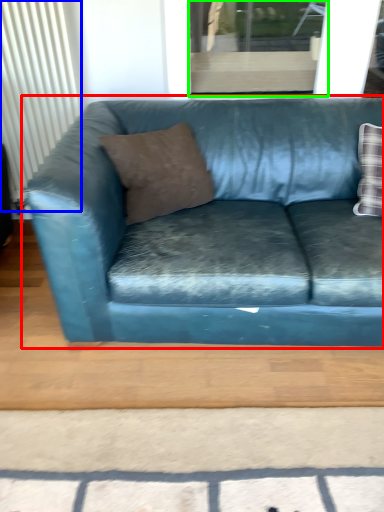
Question: Based on their relative distances, which object is farther from studio couch (highlighted by a red box)? Choose from radiator (highlighted by a blue box) and window (highlighted by a green box).

Choices:
 (A) radiator
 (B) window

Answer: (A)